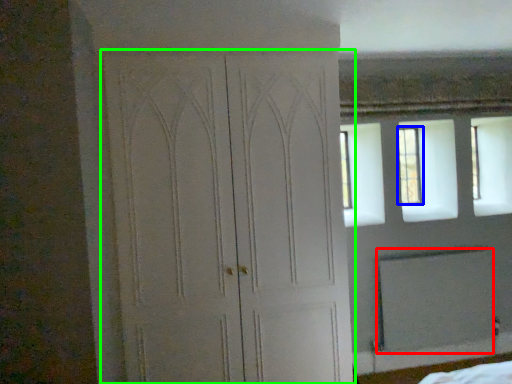
Question: Which object is positioned closest to screen door (highlighted by a red box)? Select from window (highlighted by a blue box) and door (highlighted by a green box).

Choices:
 (A) window
 (B) door

Answer: (A)